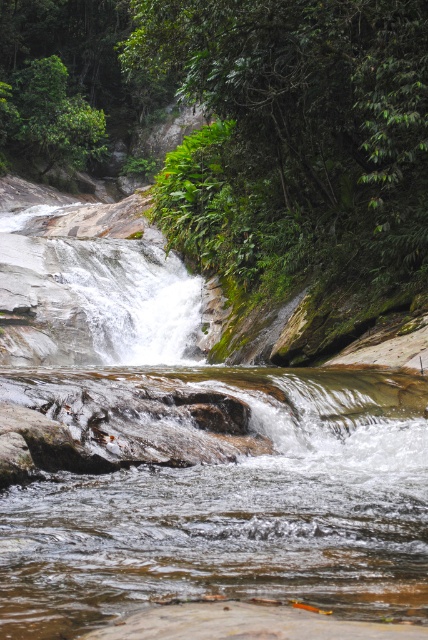
Question: Observing the image, what is the correct spatial positioning of translucent wet rock at center in reference to green leafy forest at upper center?

Choices:
 (A) left
 (B) right

Answer: (B)

Question: Can you confirm if translucent wet rock at center is thinner than green leafy forest at upper center?

Choices:
 (A) yes
 (B) no

Answer: (A)

Question: Which point is closer to the camera?

Choices:
 (A) click(x=169, y=211)
 (B) click(x=45, y=618)

Answer: (B)

Question: Can you confirm if translucent wet rock at center is wider than green leafy forest at upper center?

Choices:
 (A) yes
 (B) no

Answer: (B)

Question: Among these objects, which one is farthest from the camera?

Choices:
 (A) green leafy forest at upper center
 (B) translucent wet rock at center

Answer: (A)